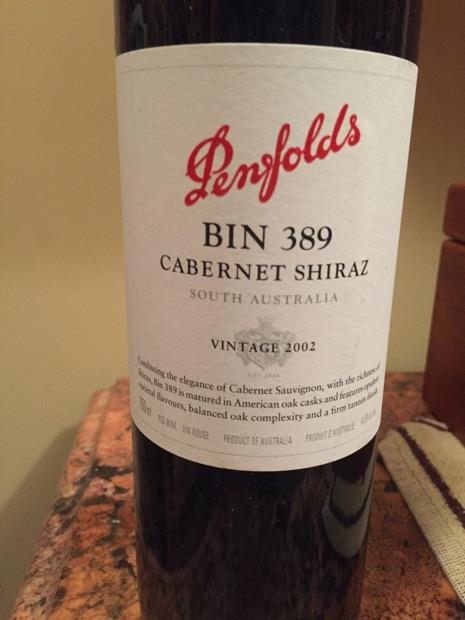
Identify the location of bottle. The height and width of the screenshot is (620, 465). (271, 558).